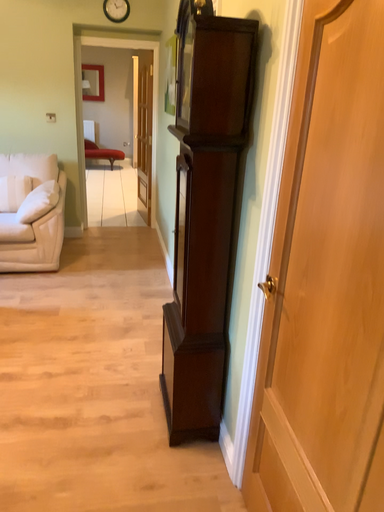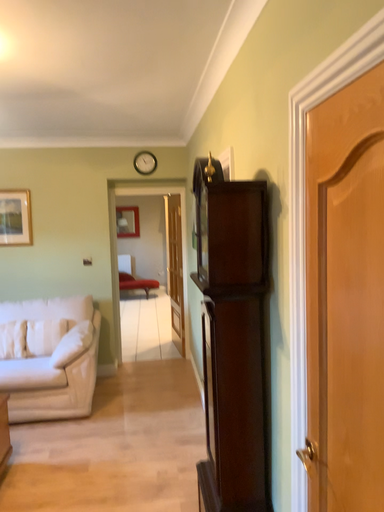
Question: Which way did the camera rotate in the video?

Choices:
 (A) rotated downward
 (B) rotated upward

Answer: (B)